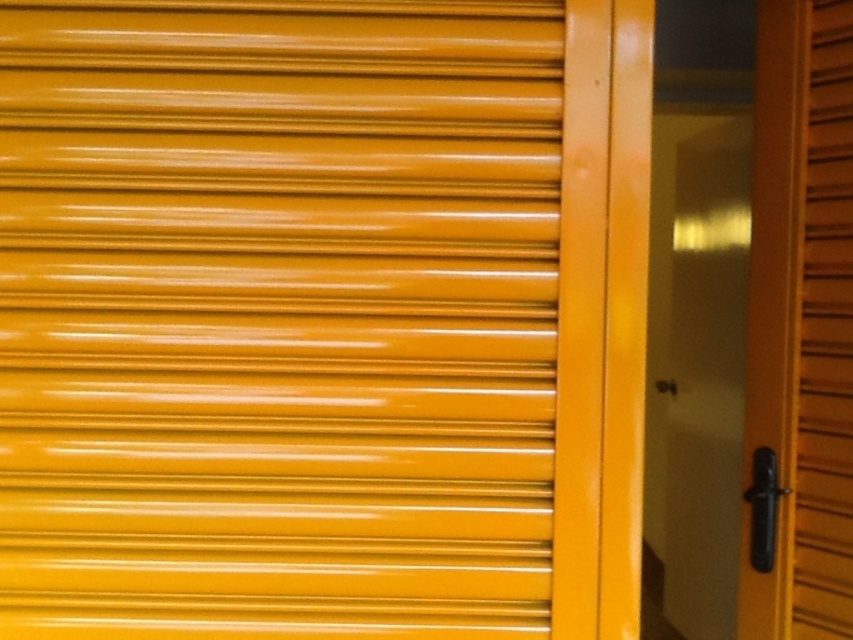
Can you confirm if glossy yellow shutter at center is shorter than matte yellow shutter at right?

Indeed, glossy yellow shutter at center has a lesser height compared to matte yellow shutter at right.

Measure the distance between glossy yellow shutter at center and camera.

glossy yellow shutter at center and camera are 1.62 meters apart.

Where is `glossy yellow shutter at center`? Image resolution: width=853 pixels, height=640 pixels. glossy yellow shutter at center is located at coordinates click(277, 316).

Can you confirm if matte yellow screen door at right is bigger than matte yellow shutter at right?

Yes, matte yellow screen door at right is bigger than matte yellow shutter at right.

From the picture: Is matte yellow screen door at right positioned behind matte yellow shutter at right?

That is True.

In the scene shown: Who is more distant from viewer, (757, 45) or (843, 385)?

Point (757, 45)

The image size is (853, 640). I want to click on matte yellow screen door at right, so click(x=703, y=317).

Who is more distant from viewer, (x=148, y=426) or (x=656, y=100)?

Point (x=656, y=100)

In the scene shown: Is glossy yellow shutter at center thinner than matte yellow screen door at right?

Incorrect, glossy yellow shutter at center's width is not less than matte yellow screen door at right's.

Does point (78, 17) come behind point (693, 54)?

No, (78, 17) is in front of (693, 54).

Where is `glossy yellow shutter at center`? The width and height of the screenshot is (853, 640). glossy yellow shutter at center is located at coordinates (277, 316).